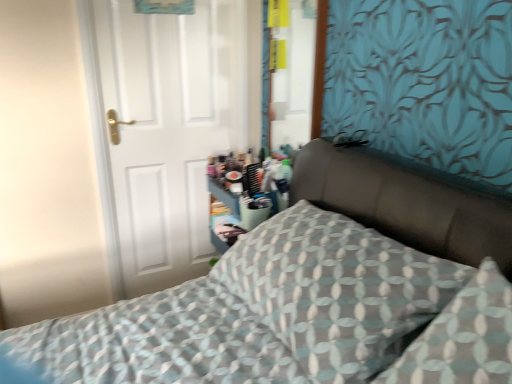
Question: Is patterned fabric pillow at center smaller than patterned fabric bed at center?

Choices:
 (A) no
 (B) yes

Answer: (B)

Question: Considering the relative sizes of patterned fabric pillow at center and patterned fabric bed at center in the image provided, is patterned fabric pillow at center wider than patterned fabric bed at center?

Choices:
 (A) no
 (B) yes

Answer: (A)

Question: Can you confirm if patterned fabric pillow at center is thinner than patterned fabric bed at center?

Choices:
 (A) no
 (B) yes

Answer: (B)

Question: From a real-world perspective, is patterned fabric pillow at center on patterned fabric bed at center?

Choices:
 (A) yes
 (B) no

Answer: (A)

Question: Does patterned fabric pillow at center have a greater height compared to patterned fabric bed at center?

Choices:
 (A) yes
 (B) no

Answer: (B)

Question: From the image's perspective, is patterned fabric bed at center positioned above or below patterned fabric pillow at center?

Choices:
 (A) above
 (B) below

Answer: (B)

Question: From a real-world perspective, relative to patterned fabric pillow at center, is patterned fabric bed at center vertically above or below?

Choices:
 (A) above
 (B) below

Answer: (B)

Question: Is patterned fabric bed at center taller or shorter than patterned fabric pillow at center?

Choices:
 (A) tall
 (B) short

Answer: (A)

Question: Would you say patterned fabric bed at center is to the left or to the right of patterned fabric pillow at center in the picture?

Choices:
 (A) left
 (B) right

Answer: (A)

Question: In terms of size, does patterned fabric pillow at center appear bigger or smaller than white matte door at left?

Choices:
 (A) big
 (B) small

Answer: (A)

Question: Do you think patterned fabric pillow at center is within white matte door at left, or outside of it?

Choices:
 (A) outside
 (B) inside

Answer: (A)

Question: Considering the positions of patterned fabric pillow at center and white matte door at left in the image, is patterned fabric pillow at center taller or shorter than white matte door at left?

Choices:
 (A) short
 (B) tall

Answer: (A)

Question: Is patterned fabric pillow at center to the left or to the right of white matte door at left in the image?

Choices:
 (A) left
 (B) right

Answer: (B)

Question: Considering the relative positions of white matte door at left and patterned fabric pillow at center in the image provided, is white matte door at left to the left or to the right of patterned fabric pillow at center?

Choices:
 (A) left
 (B) right

Answer: (A)

Question: In terms of height, does white matte door at left look taller or shorter compared to patterned fabric pillow at center?

Choices:
 (A) short
 (B) tall

Answer: (B)